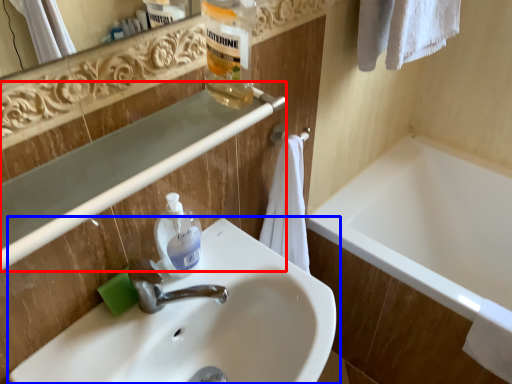
Question: Which object is further to the camera taking this photo, balustrade (highlighted by a red box) or sink (highlighted by a blue box)?

Choices:
 (A) balustrade
 (B) sink

Answer: (B)